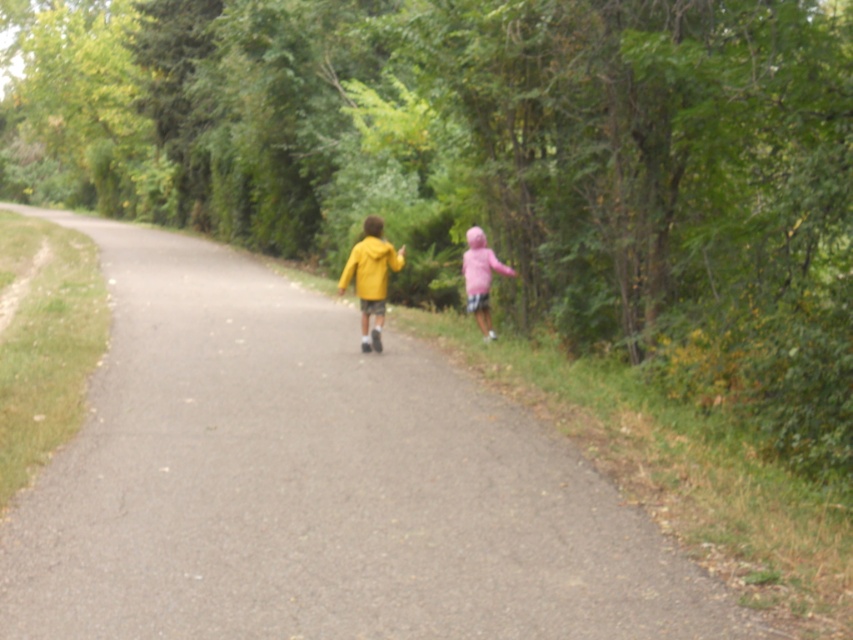
Question: Can you confirm if matte yellow jacket at center is positioned to the right of pink fleece jacket at right?

Choices:
 (A) no
 (B) yes

Answer: (A)

Question: Which object appears farthest from the camera in this image?

Choices:
 (A) matte yellow jacket at center
 (B) asphalt road at center
 (C) pink fleece jacket at right

Answer: (C)

Question: Can you confirm if asphalt road at center is positioned to the left of pink fleece jacket at right?

Choices:
 (A) yes
 (B) no

Answer: (A)

Question: Which object is farther from the camera taking this photo?

Choices:
 (A) pink fleece jacket at right
 (B) asphalt road at center
 (C) matte yellow jacket at center

Answer: (A)

Question: Does asphalt road at center have a smaller size compared to pink fleece jacket at right?

Choices:
 (A) no
 (B) yes

Answer: (A)

Question: Which of the following is the farthest from the observer?

Choices:
 (A) (355, 253)
 (B) (488, 289)
 (C) (335, 544)

Answer: (B)